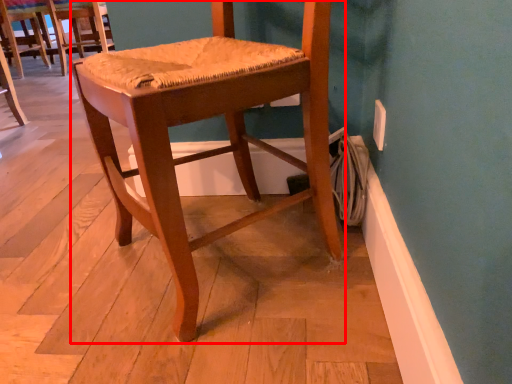
Question: Observing the image, what is the correct spatial positioning of chair (annotated by the red box) in reference to chair?

Choices:
 (A) right
 (B) left

Answer: (A)